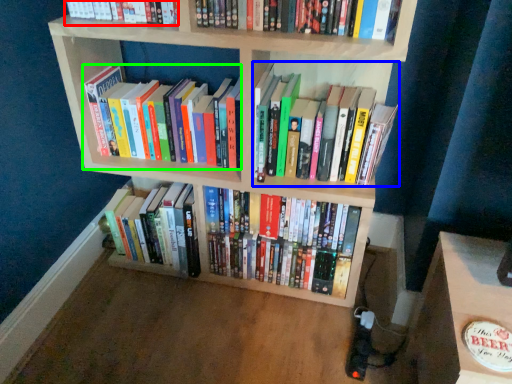
Question: Considering the real-world distances, which object is closest to book (highlighted by a red box)? book (highlighted by a blue box) or book (highlighted by a green box).

Choices:
 (A) book
 (B) book

Answer: (B)